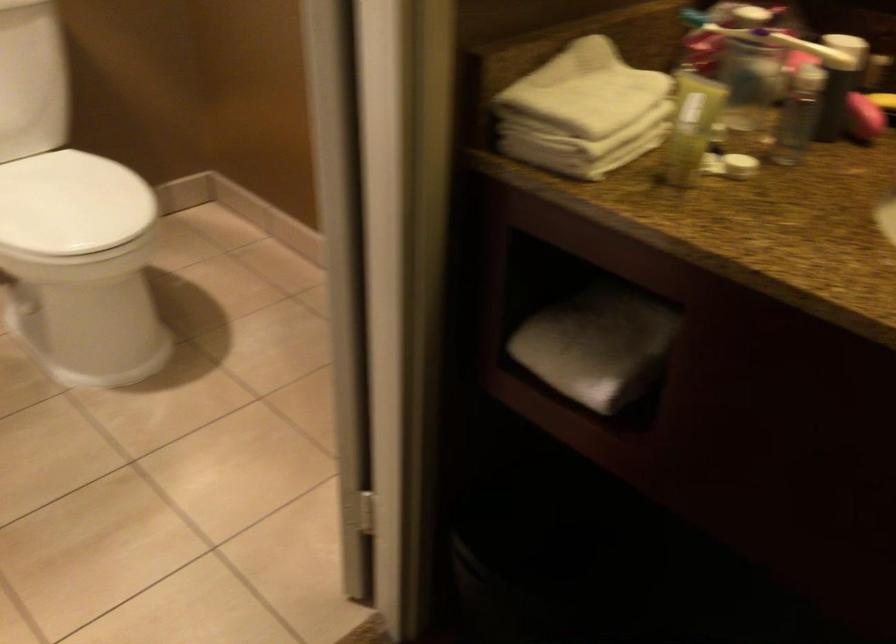
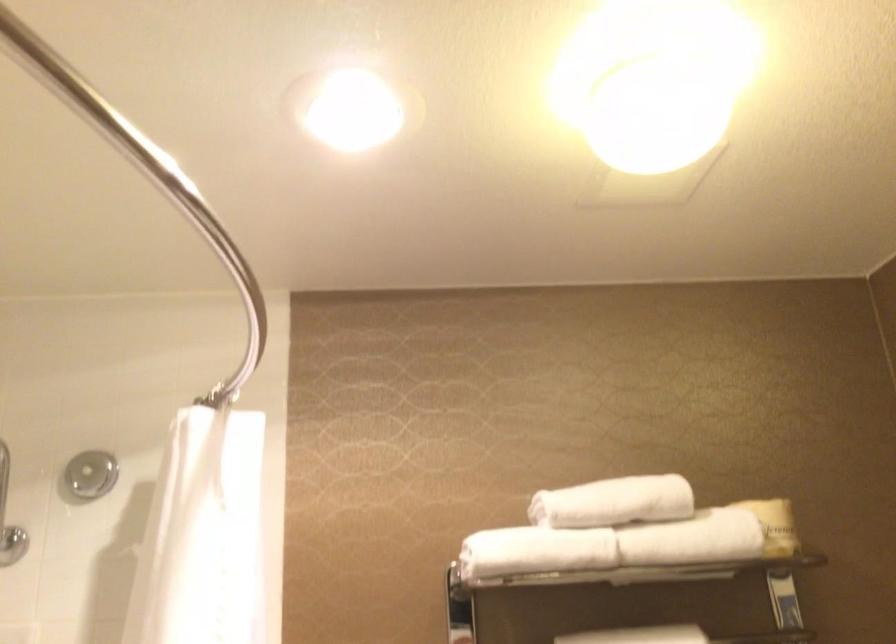
The images are taken continuously from a first-person perspective. In which direction is your viewpoint rotating?

The rotation direction of the camera is left-up.